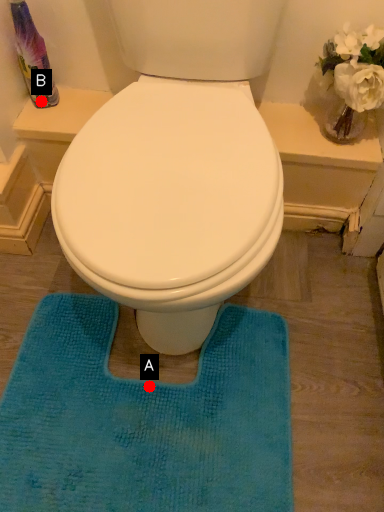
Question: Two points are circled on the image, labeled by A and B beside each circle. Among these points, which one is farthest from the camera?

Choices:
 (A) A is further
 (B) B is further

Answer: (B)